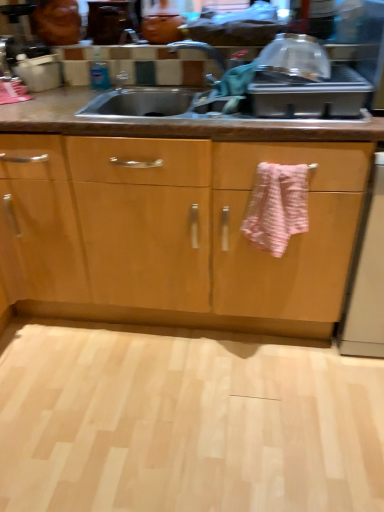
Question: Is light wood floor at lower center oriented away from white glossy dishwasher at right?

Choices:
 (A) no
 (B) yes

Answer: (A)

Question: Is light wood floor at lower center shorter than white glossy dishwasher at right?

Choices:
 (A) no
 (B) yes

Answer: (B)

Question: Is light wood floor at lower center at the left side of white glossy dishwasher at right?

Choices:
 (A) no
 (B) yes

Answer: (B)

Question: Can you confirm if light wood floor at lower center is thinner than white glossy dishwasher at right?

Choices:
 (A) yes
 (B) no

Answer: (B)

Question: Does light wood floor at lower center have a greater width compared to white glossy dishwasher at right?

Choices:
 (A) no
 (B) yes

Answer: (B)

Question: From the image's perspective, does light wood floor at lower center appear lower than white glossy dishwasher at right?

Choices:
 (A) no
 (B) yes

Answer: (B)

Question: Can you confirm if light wood floor at lower center is positioned to the right of pink textured towel at center?

Choices:
 (A) no
 (B) yes

Answer: (A)

Question: Can you confirm if light wood floor at lower center is smaller than pink textured towel at center?

Choices:
 (A) yes
 (B) no

Answer: (B)

Question: Is light wood floor at lower center with pink textured towel at center?

Choices:
 (A) yes
 (B) no

Answer: (B)

Question: Can you confirm if light wood floor at lower center is positioned to the left of pink textured towel at center?

Choices:
 (A) yes
 (B) no

Answer: (A)

Question: Can we say light wood floor at lower center lies outside pink textured towel at center?

Choices:
 (A) no
 (B) yes

Answer: (B)

Question: From a real-world perspective, is light wood floor at lower center below pink textured towel at center?

Choices:
 (A) no
 (B) yes

Answer: (B)

Question: Is pink textured towel at center next to light wood floor at lower center?

Choices:
 (A) yes
 (B) no

Answer: (B)